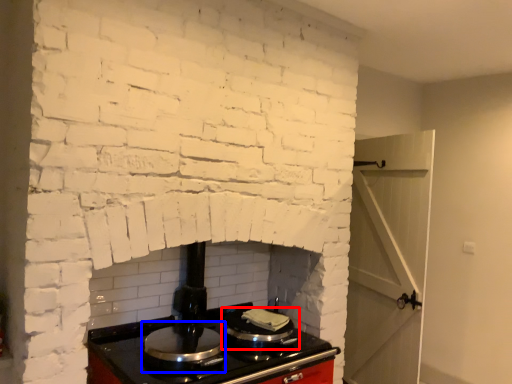
Question: Which object is closer to the camera taking this photo, kitchen appliance (highlighted by a red box) or appliance (highlighted by a blue box)?

Choices:
 (A) kitchen appliance
 (B) appliance

Answer: (B)